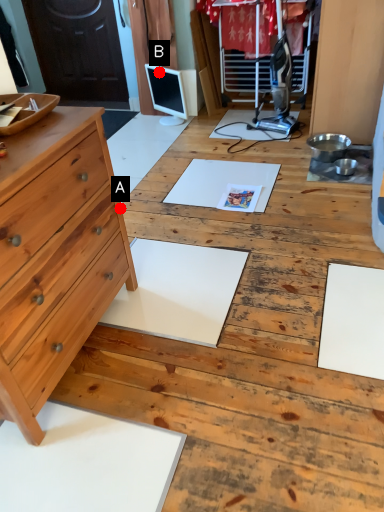
Question: Two points are circled on the image, labeled by A and B beside each circle. Which point is further to the camera?

Choices:
 (A) A is further
 (B) B is further

Answer: (B)